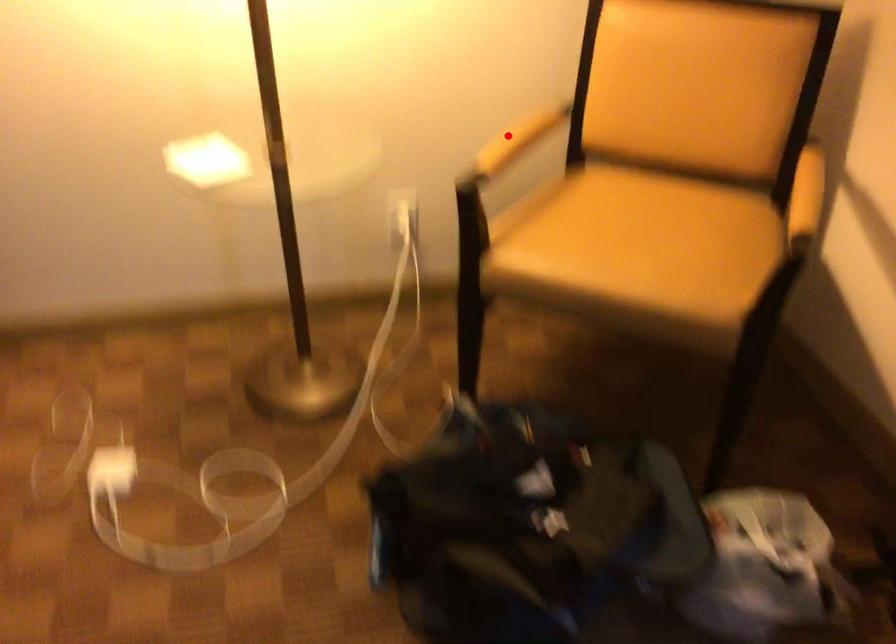
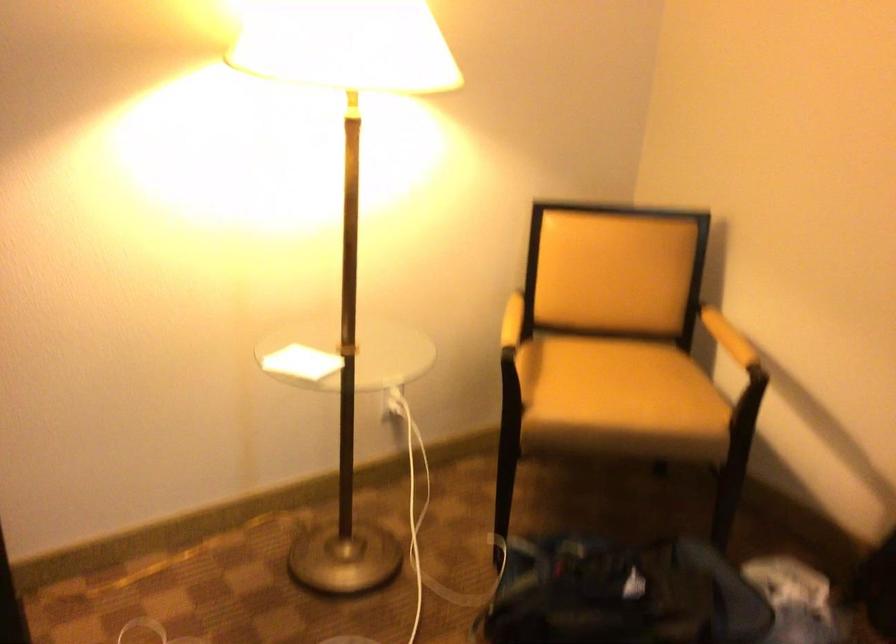
Question: A red point is marked in image1. In image2, is the corresponding 3D point closer to the camera or farther? Reply with the corresponding letter.

Choices:
 (A) The corresponding 3D point is closer.
 (B) The corresponding 3D point is farther.

Answer: (B)